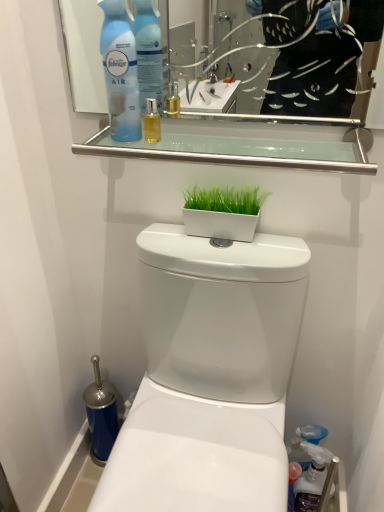
What is the approximate width of translucent plastic spray bottle at lower right, the 2th cleaning product positioned from the top?

translucent plastic spray bottle at lower right, the 2th cleaning product positioned from the top, is 6.33 centimeters in width.

Describe the element at coordinates (220, 224) in the screenshot. This screenshot has height=512, width=384. I see `white glossy flowerpot at center` at that location.

I want to click on white glossy toilet at center, so click(210, 376).

This screenshot has height=512, width=384. Describe the element at coordinates (120, 72) in the screenshot. I see `blue plastic air freshener at upper left, which appears as the 1th cleaning product when viewed from the top` at that location.

Find the location of a particular element. The width and height of the screenshot is (384, 512). blue plastic air freshener at upper left, which appears as the 2th cleaning product when viewed from the right is located at coordinates (120, 72).

The width and height of the screenshot is (384, 512). What are the coordinates of `clear glass shelf at upper center` in the screenshot? It's located at (243, 147).

Is white glossy flowerpot at center turned away from clear glass shelf at upper center?

No, white glossy flowerpot at center is not facing the opposite direction of clear glass shelf at upper center.

From a real-world perspective, who is located higher, white glossy flowerpot at center or clear glass shelf at upper center?

clear glass shelf at upper center.

Consider the image. From the image's perspective, would you say white glossy flowerpot at center is shown under clear glass shelf at upper center?

Yes, from the image's perspective, white glossy flowerpot at center is below clear glass shelf at upper center.

Between white glossy flowerpot at center and clear glass shelf at upper center, which one has smaller width?

white glossy flowerpot at center.

Is white glossy flowerpot at center not inside white glossy toilet at center?

Yes, white glossy flowerpot at center is located beyond the bounds of white glossy toilet at center.

Is white glossy flowerpot at center to the right of white glossy toilet at center from the viewer's perspective?

Indeed, white glossy flowerpot at center is positioned on the right side of white glossy toilet at center.

Between white glossy flowerpot at center and white glossy toilet at center, which one has more height?

white glossy toilet at center is taller.

In the scene shown: Measure the distance between white glossy toilet at center and clear glass shelf at upper center.

white glossy toilet at center and clear glass shelf at upper center are 35.98 centimeters apart from each other.

Is white glossy toilet at center oriented away from clear glass shelf at upper center?

white glossy toilet at center does not have its back to clear glass shelf at upper center.

Considering the positions of points (262, 240) and (193, 138), is point (262, 240) farther from camera compared to point (193, 138)?

Yes.

Between white glossy flowerpot at center and blue plastic air freshener at upper left, which is the 2th cleaning product in bottom-to-top order, which one has less height?

Standing shorter between the two is white glossy flowerpot at center.

Between point (221, 226) and point (104, 25), which one is positioned behind?

The point (221, 226) is more distant.

From a real-world perspective, is white glossy flowerpot at center physically below blue plastic air freshener at upper left, which appears as the 1th cleaning product when viewed from the top?

Correct, in the physical world, white glossy flowerpot at center is lower than blue plastic air freshener at upper left, which appears as the 1th cleaning product when viewed from the top.

Considering the sizes of objects white glossy flowerpot at center and blue plastic air freshener at upper left, which is the first cleaning product in front-to-back order, in the image provided, who is bigger, white glossy flowerpot at center or blue plastic air freshener at upper left, which is the first cleaning product in front-to-back order,?

With larger size is blue plastic air freshener at upper left, which is the first cleaning product in front-to-back order.

Is translucent plastic spray bottle at lower right, placed as the first cleaning product when sorted from back to front, at the left side of white glossy flowerpot at center?

In fact, translucent plastic spray bottle at lower right, placed as the first cleaning product when sorted from back to front, is to the right of white glossy flowerpot at center.

From a real-world perspective, is translucent plastic spray bottle at lower right, which is counted as the 2th cleaning product, starting from the front, physically located above or below white glossy flowerpot at center?

Clearly, from a real-world perspective, translucent plastic spray bottle at lower right, which is counted as the 2th cleaning product, starting from the front, is below white glossy flowerpot at center.

From the picture: Is translucent plastic spray bottle at lower right, the first cleaning product in the bottom-to-top sequence, shorter than white glossy flowerpot at center?

In fact, translucent plastic spray bottle at lower right, the first cleaning product in the bottom-to-top sequence, may be taller than white glossy flowerpot at center.

Which is correct: translucent plastic spray bottle at lower right, the 2th cleaning product in the left-to-right sequence, is inside white glossy flowerpot at center, or outside of it?

translucent plastic spray bottle at lower right, the 2th cleaning product in the left-to-right sequence, lies outside white glossy flowerpot at center.

You are a GUI agent. You are given a task and a screenshot of the screen. Output one action in this format:
    pyautogui.click(x=<x>, y=<y>)
    Task: Click on the cleaning product that is on the right side of white glossy flowerpot at center
    
    Given the screenshot: What is the action you would take?
    pyautogui.click(x=311, y=478)

Based on their sizes in the image, would you say white glossy flowerpot at center is bigger or smaller than translucent plastic spray bottle at lower right, the 2th cleaning product positioned from the top?

Clearly, white glossy flowerpot at center is smaller in size than translucent plastic spray bottle at lower right, the 2th cleaning product positioned from the top.

Which object is thinner, white glossy flowerpot at center or translucent plastic spray bottle at lower right, placed as the first cleaning product when sorted from back to front?

With smaller width is white glossy flowerpot at center.

Is white glossy flowerpot at center looking in the opposite direction of translucent plastic spray bottle at lower right, placed as the first cleaning product when sorted from back to front?

No.

Which is further, [245,501] or [118,47]?

The point [245,501] is farther from the camera.

Does white glossy toilet at center appear on the right side of blue plastic air freshener at upper left, which is the 2th cleaning product in bottom-to-top order?

Yes.

From a real-world perspective, is white glossy toilet at center below blue plastic air freshener at upper left, which is the first cleaning product in front-to-back order?

Indeed, from a real-world perspective, white glossy toilet at center is positioned beneath blue plastic air freshener at upper left, which is the first cleaning product in front-to-back order.

Considering the sizes of white glossy toilet at center and blue plastic air freshener at upper left, which is the first cleaning product in front-to-back order, in the image, is white glossy toilet at center taller or shorter than blue plastic air freshener at upper left, which is the first cleaning product in front-to-back order,?

In the image, white glossy toilet at center appears to be taller than blue plastic air freshener at upper left, which is the first cleaning product in front-to-back order.

Find the location of `flowerpot located below the clear glass shelf at upper center (from the image's perspective)`. flowerpot located below the clear glass shelf at upper center (from the image's perspective) is located at coordinates (220, 224).

Where is `flowerpot on the right of the white glossy toilet at center`? flowerpot on the right of the white glossy toilet at center is located at coordinates (220, 224).

Based on their spatial positions, is translucent plastic spray bottle at lower right, the 2th cleaning product positioned from the top, or blue plastic air freshener at upper left, which is the 2th cleaning product in bottom-to-top order, further from white glossy flowerpot at center?

translucent plastic spray bottle at lower right, the 2th cleaning product positioned from the top.

Considering their positions, is translucent plastic spray bottle at lower right, placed as the first cleaning product when sorted from back to front, positioned closer to white glossy toilet at center than blue plastic air freshener at upper left, acting as the second cleaning product starting from the back?

Based on the image, translucent plastic spray bottle at lower right, placed as the first cleaning product when sorted from back to front, appears to be nearer to white glossy toilet at center.

From the image, which object appears to be farther from white glossy toilet at center, blue plastic air freshener at upper left, which is the 2th cleaning product in bottom-to-top order, or clear glass shelf at upper center?

blue plastic air freshener at upper left, which is the 2th cleaning product in bottom-to-top order, is further to white glossy toilet at center.

Looking at the image, which one is located closer to blue plastic air freshener at upper left, which is the first cleaning product in front-to-back order, white glossy flowerpot at center or white glossy toilet at center?

The object closer to blue plastic air freshener at upper left, which is the first cleaning product in front-to-back order, is white glossy flowerpot at center.

In the scene shown: When comparing their distances from blue plastic air freshener at upper left, which is the first cleaning product in front-to-back order, does clear glass shelf at upper center or white glossy toilet at center seem further?

white glossy toilet at center.

From the image, which object appears to be farther from white glossy flowerpot at center, blue plastic air freshener at upper left, which is the first cleaning product in front-to-back order, or white glossy toilet at center?

Based on the image, blue plastic air freshener at upper left, which is the first cleaning product in front-to-back order, appears to be further to white glossy flowerpot at center.

Which object lies further to the anchor point clear glass shelf at upper center, blue plastic air freshener at upper left, which appears as the 2th cleaning product when viewed from the right, or translucent plastic spray bottle at lower right, the 2th cleaning product positioned from the top?

Based on the image, translucent plastic spray bottle at lower right, the 2th cleaning product positioned from the top, appears to be further to clear glass shelf at upper center.

Based on their spatial positions, is white glossy flowerpot at center or white glossy toilet at center closer to clear glass shelf at upper center?

white glossy flowerpot at center is positioned closer to the anchor clear glass shelf at upper center.

The height and width of the screenshot is (512, 384). What are the coordinates of `flowerpot between clear glass shelf at upper center and translucent plastic spray bottle at lower right, placed as the first cleaning product when sorted from back to front, vertically` in the screenshot? It's located at pos(220,224).

Where is `balustrade between blue plastic air freshener at upper left, which is the first cleaning product in front-to-back order, and white glossy flowerpot at center vertically`? balustrade between blue plastic air freshener at upper left, which is the first cleaning product in front-to-back order, and white glossy flowerpot at center vertically is located at coordinates (243, 147).

Identify the location of flowerpot between blue plastic air freshener at upper left, which appears as the 2th cleaning product when viewed from the right, and white glossy toilet at center vertically. The image size is (384, 512). (220, 224).

Where is `flowerpot between blue plastic air freshener at upper left, which appears as the 2th cleaning product when viewed from the right, and translucent plastic spray bottle at lower right, the first cleaning product in the bottom-to-top sequence, in the vertical direction`? flowerpot between blue plastic air freshener at upper left, which appears as the 2th cleaning product when viewed from the right, and translucent plastic spray bottle at lower right, the first cleaning product in the bottom-to-top sequence, in the vertical direction is located at coordinates (220, 224).